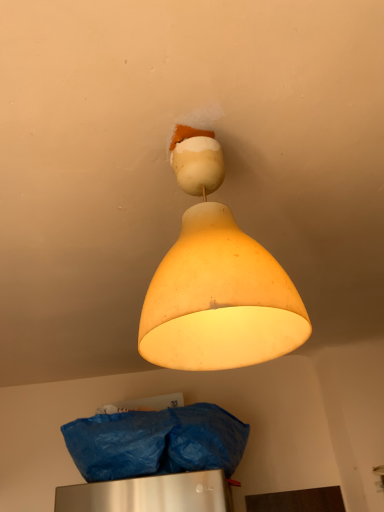
Question: Based on their sizes in the image, would you say matte yellow lampshade at upper center is bigger or smaller than blue plastic bag at lower center?

Choices:
 (A) small
 (B) big

Answer: (A)

Question: From the image's perspective, is matte yellow lampshade at upper center above or below blue plastic bag at lower center?

Choices:
 (A) above
 (B) below

Answer: (A)

Question: From a real-world perspective, is matte yellow lampshade at upper center physically located above or below blue plastic bag at lower center?

Choices:
 (A) below
 (B) above

Answer: (B)

Question: Is point (185, 449) closer or farther from the camera than point (152, 278)?

Choices:
 (A) farther
 (B) closer

Answer: (A)

Question: From the image's perspective, relative to matte yellow lampshade at upper center, is blue plastic bag at lower center above or below?

Choices:
 (A) below
 (B) above

Answer: (A)

Question: Looking at their shapes, would you say blue plastic bag at lower center is wider or thinner than matte yellow lampshade at upper center?

Choices:
 (A) wide
 (B) thin

Answer: (A)

Question: From a real-world perspective, relative to matte yellow lampshade at upper center, is blue plastic bag at lower center vertically above or below?

Choices:
 (A) below
 (B) above

Answer: (A)